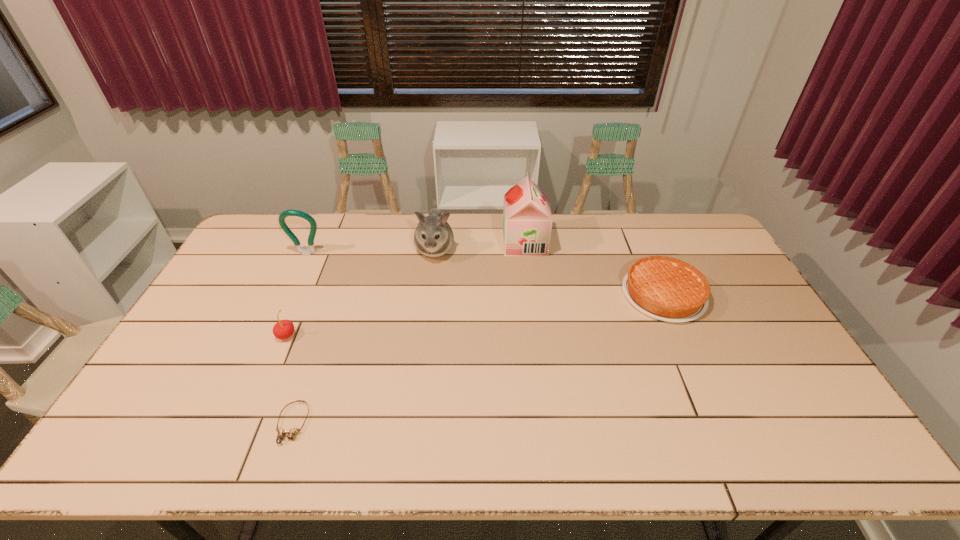
Image resolution: width=960 pixels, height=540 pixels. What are the coordinates of `vacant space that satisfies the following two spatial constraints: 1. with the cap open on the fifth object from left to right; 2. on the face of the fourth object from left to right` in the screenshot? It's located at [x=525, y=249].

Identify the location of free space that satisfies the following two spatial constraints: 1. with the cap open on the tallest object; 2. on the right side of the pie. (531, 295).